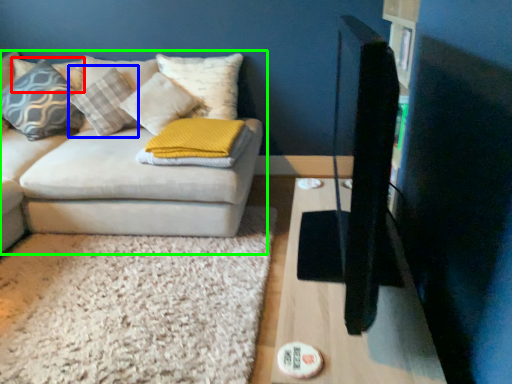
Question: Which object is the closest to the pillow (highlighted by a red box)? Choose among these: pillow (highlighted by a blue box) or studio couch (highlighted by a green box).

Choices:
 (A) pillow
 (B) studio couch

Answer: (A)